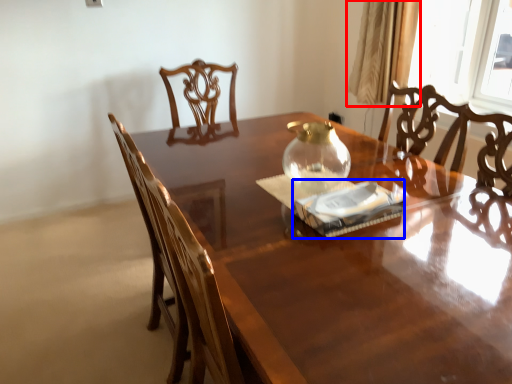
Question: Which object appears closest to the camera in this image, curtain (highlighted by a red box) or paperback book (highlighted by a blue box)?

Choices:
 (A) curtain
 (B) paperback book

Answer: (B)